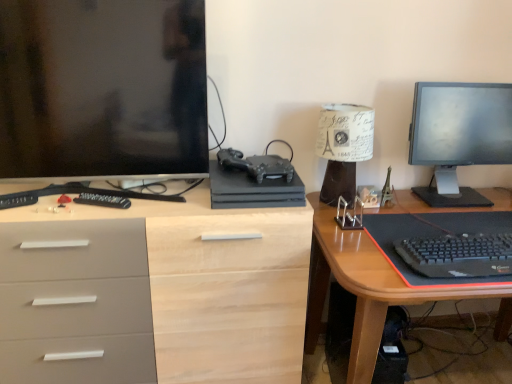
Where is `free point in front of black plastic remote control at left, placed as the second remote control when sorted from left to right`? Image resolution: width=512 pixels, height=384 pixels. free point in front of black plastic remote control at left, placed as the second remote control when sorted from left to right is located at coordinates (90, 212).